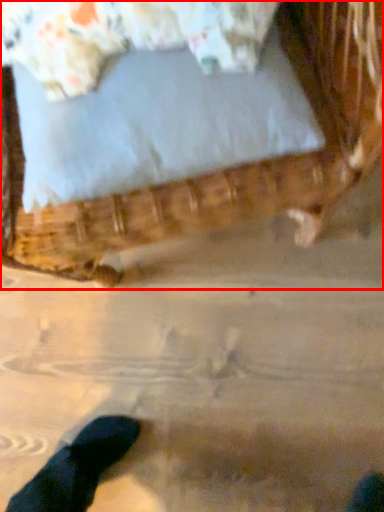
Question: Considering the relative positions of furniture (annotated by the red box) and pillow in the image provided, where is furniture (annotated by the red box) located with respect to the staircase?

Choices:
 (A) right
 (B) left

Answer: (B)